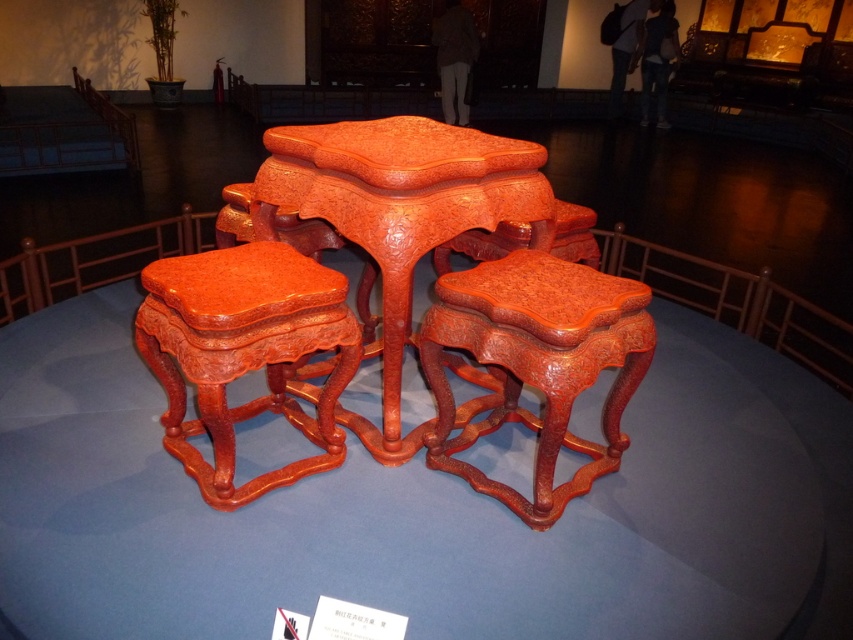
You are a furniture designer examining the traditional Chinese lacquered furniture arrangement. You notice the cinnabar lacquer table at center and the glossy lacquered stool at center. Which object is placed directly above the other?

The cinnabar lacquer table at center is positioned over the glossy lacquered stool at center, meaning the table is above the stool.

You are standing at the center of the circular platform where the cinnabar lacquer table at center is displayed. If you walk straight ahead, which direction will you face relative to the table?

Since the cinnabar lacquer table at center is located at point (399, 216), it is slightly off the exact center of the platform. Walking straight ahead from the center would mean moving towards the table, so you would be facing the cinnabar lacquer table at center directly.